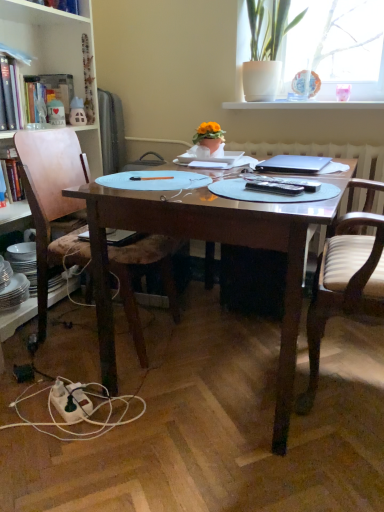
The height and width of the screenshot is (512, 384). Find the location of `vacant area that is in front of wooden chair at left, marked as the second chair in a right-to-left arrangement`. vacant area that is in front of wooden chair at left, marked as the second chair in a right-to-left arrangement is located at coordinates (57, 415).